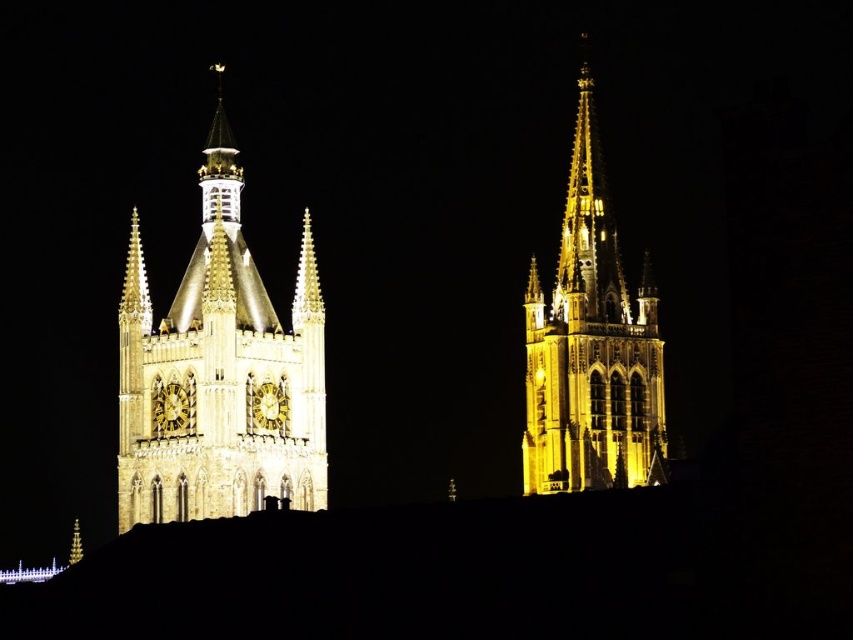
Between gold polished spire at upper center and gold metallic spire at center, which one appears on the left side from the viewer's perspective?

Positioned to the left is gold polished spire at upper center.

This screenshot has height=640, width=853. What do you see at coordinates (219, 164) in the screenshot? I see `gold polished spire at upper center` at bounding box center [219, 164].

Is point (219, 193) in front of point (305, 307)?

No, it is behind (305, 307).

The height and width of the screenshot is (640, 853). What are the coordinates of `gold polished spire at upper center` in the screenshot? It's located at (219, 164).

Is golden stone tower at left below golden stone tower at upper right?

Indeed, golden stone tower at left is positioned under golden stone tower at upper right.

Describe the element at coordinates (215, 376) in the screenshot. The width and height of the screenshot is (853, 640). I see `golden stone tower at left` at that location.

Does point (287, 368) lie behind point (622, 330)?

No, it is in front of (622, 330).

You are a GUI agent. You are given a task and a screenshot of the screen. Output one action in this format:
    pyautogui.click(x=<x>, y=<y>)
    Task: Click on the golden stone tower at left
    
    Given the screenshot: What is the action you would take?
    pyautogui.click(x=215, y=376)

At what (x,y) coordinates should I click in order to perform the action: click on golden stone tower at upper right. Please return your answer as a coordinate pair (x, y). Looking at the image, I should click on (590, 346).

Does golden stone tower at upper right appear over gold metallic spire at upper center?

Indeed, golden stone tower at upper right is positioned over gold metallic spire at upper center.

Who is more forward, [525,461] or [79,529]?

Positioned in front is point [525,461].

Find the location of a particular element. Image resolution: width=853 pixels, height=640 pixels. golden stone tower at upper right is located at coordinates (590, 346).